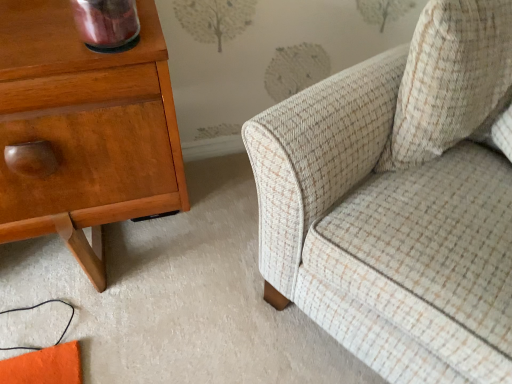
Question: From the image's perspective, would you say shiny wood nightstand at left is shown under beige textured cushion at upper right?

Choices:
 (A) yes
 (B) no

Answer: (A)

Question: Considering the relative positions of shiny wood nightstand at left and beige textured cushion at upper right in the image provided, is shiny wood nightstand at left to the left of beige textured cushion at upper right from the viewer's perspective?

Choices:
 (A) yes
 (B) no

Answer: (A)

Question: From a real-world perspective, is shiny wood nightstand at left located beneath beige textured cushion at upper right?

Choices:
 (A) no
 (B) yes

Answer: (B)

Question: Does shiny wood nightstand at left come in front of beige textured cushion at upper right?

Choices:
 (A) yes
 (B) no

Answer: (A)

Question: Is shiny wood nightstand at left facing towards beige textured cushion at upper right?

Choices:
 (A) yes
 (B) no

Answer: (B)

Question: Looking at their shapes, would you say shiny wood nightstand at left is wider or thinner than beige tweed sofa at right?

Choices:
 (A) wide
 (B) thin

Answer: (B)

Question: Which is correct: shiny wood nightstand at left is inside beige tweed sofa at right, or outside of it?

Choices:
 (A) inside
 (B) outside

Answer: (B)

Question: From the image's perspective, is shiny wood nightstand at left positioned above or below beige tweed sofa at right?

Choices:
 (A) below
 (B) above

Answer: (A)

Question: Is shiny wood nightstand at left taller or shorter than beige tweed sofa at right?

Choices:
 (A) tall
 (B) short

Answer: (B)

Question: Relative to shiny wood nightstand at left, is beige tweed sofa at right in front or behind?

Choices:
 (A) front
 (B) behind

Answer: (A)

Question: Is beige tweed sofa at right bigger or smaller than shiny wood nightstand at left?

Choices:
 (A) big
 (B) small

Answer: (A)

Question: From a real-world perspective, is beige tweed sofa at right physically located above or below shiny wood nightstand at left?

Choices:
 (A) above
 (B) below

Answer: (A)

Question: From the image's perspective, is beige tweed sofa at right located above or below shiny wood nightstand at left?

Choices:
 (A) below
 (B) above

Answer: (B)

Question: In terms of width, does beige textured cushion at upper right look wider or thinner when compared to shiny wood nightstand at left?

Choices:
 (A) wide
 (B) thin

Answer: (B)

Question: Visually, is beige textured cushion at upper right positioned to the left or to the right of shiny wood nightstand at left?

Choices:
 (A) right
 (B) left

Answer: (A)